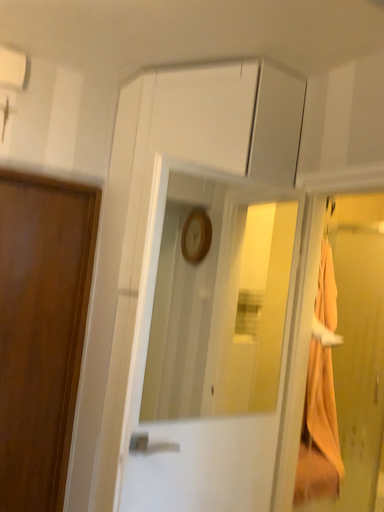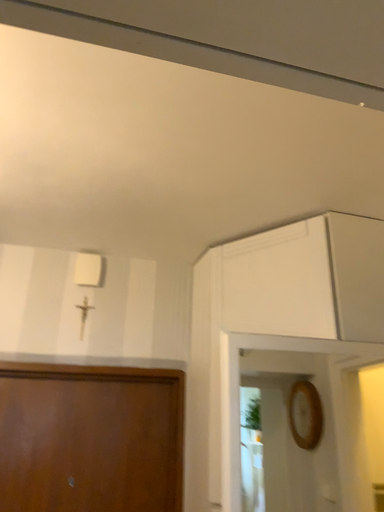
Question: How did the camera likely rotate when shooting the video?

Choices:
 (A) rotated left
 (B) rotated right

Answer: (A)